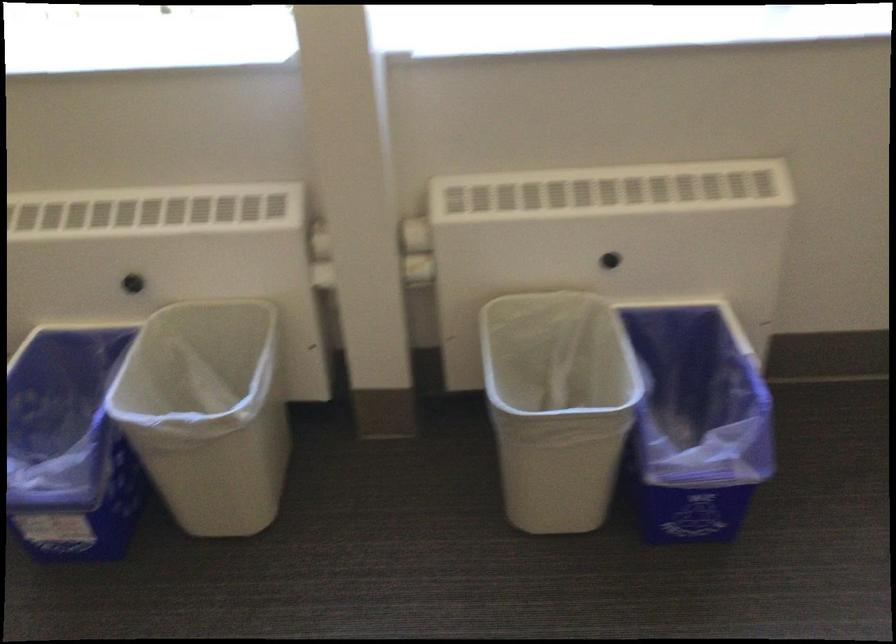
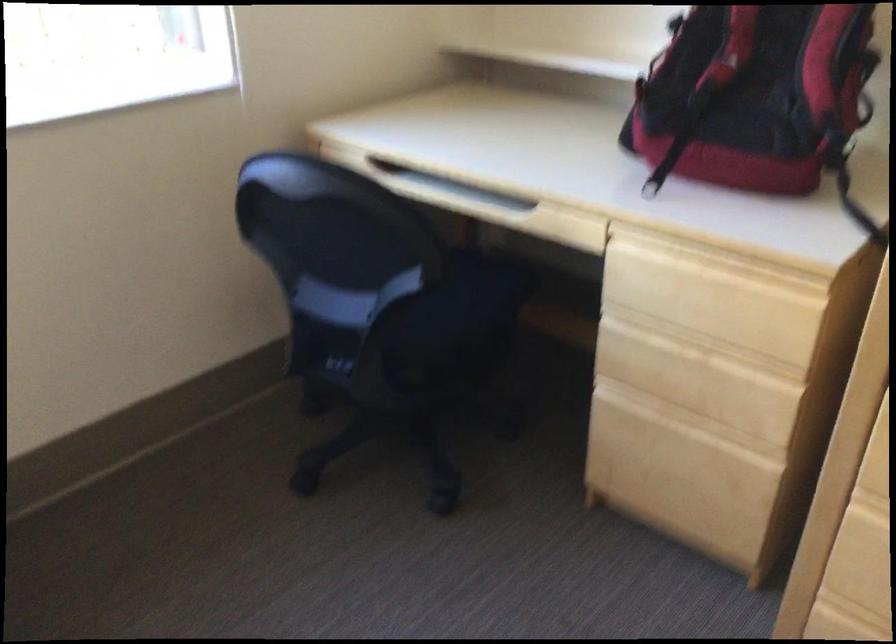
Question: The camera is either moving clockwise (left) or counter-clockwise (right) around the object. The first image is from the beginning of the video and the second image is from the end. Is the camera moving left or right when shooting the video?

Choices:
 (A) Left
 (B) Right

Answer: (A)